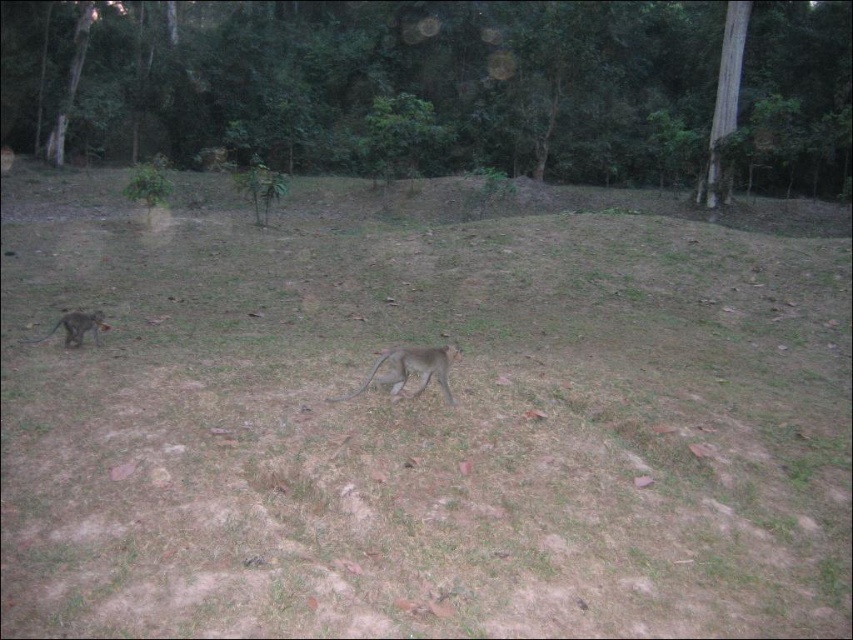
You are standing in a forest at dusk and see two points marked on the ground. The first point is at coordinates point (437, 356) and the second is at point (45, 339). Which point is closer to your current position?

Point (437, 356) is closer to the camera than point (45, 339), so the first point is closer to your current position.

You are a wildlife photographer carrying a camera bag that is 1.2 meters wide. You want to walk between the gray furry monkey at center and the gray fur monkey at lower left. Can your camera bag fit through the space between them?

The distance between the gray furry monkey at center and the gray fur monkey at lower left is 2.80 meters. Since your camera bag is only 1.2 meters wide, it will easily fit through the space between them.